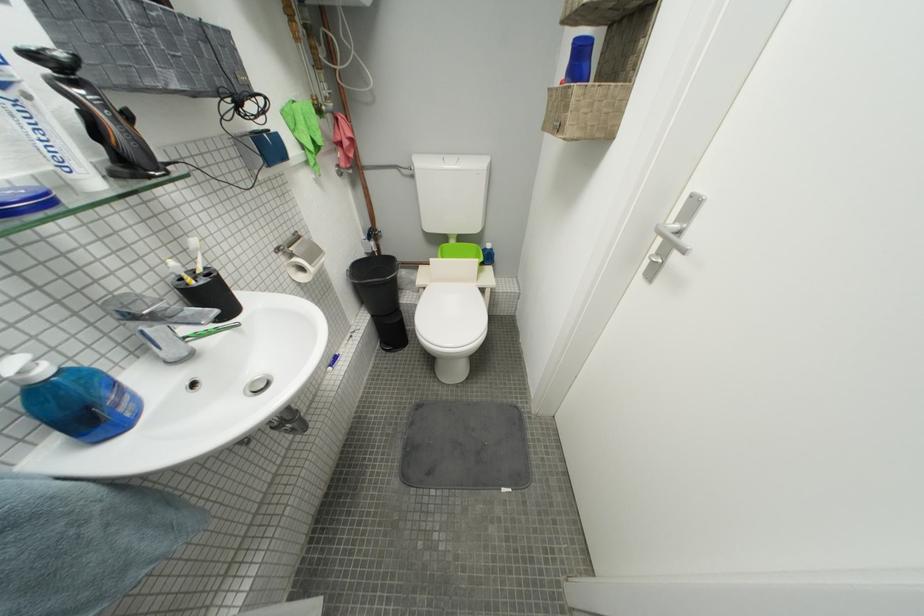
You are a GUI agent. You are given a task and a screenshot of the screen. Output one action in this format:
    pyautogui.click(x=<x>, y=<y>)
    Task: Click on the blue plastic bottle
    
    Given the screenshot: What is the action you would take?
    pyautogui.click(x=73, y=398)